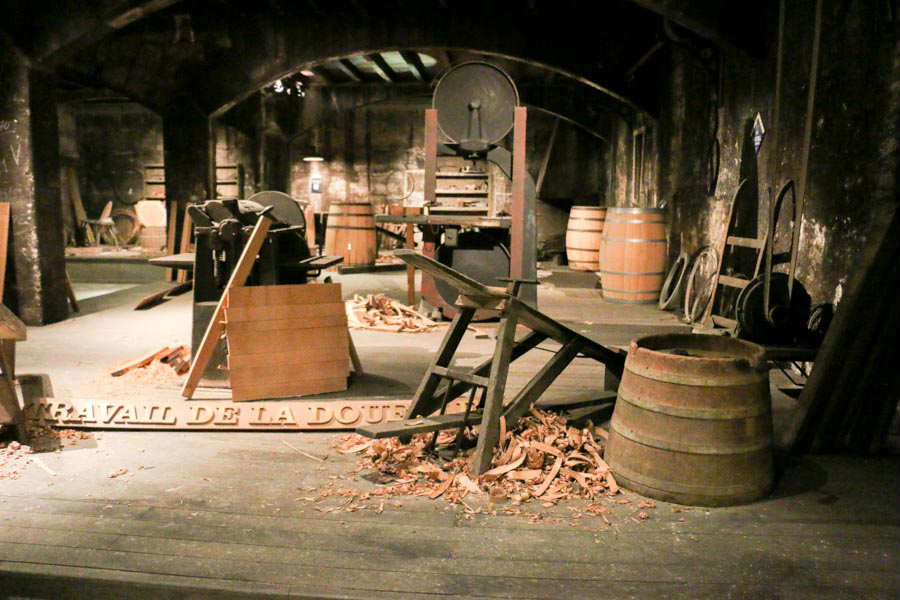
Identify the location of lights. This screenshot has width=900, height=600. (279, 90), (312, 170).